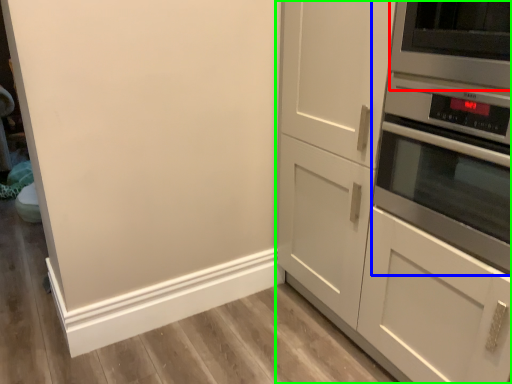
Question: Based on their relative distances, which object is nearer to appliance (highlighted by a red box)? Choose from home appliance (highlighted by a blue box) and cabinetry (highlighted by a green box).

Choices:
 (A) home appliance
 (B) cabinetry

Answer: (A)